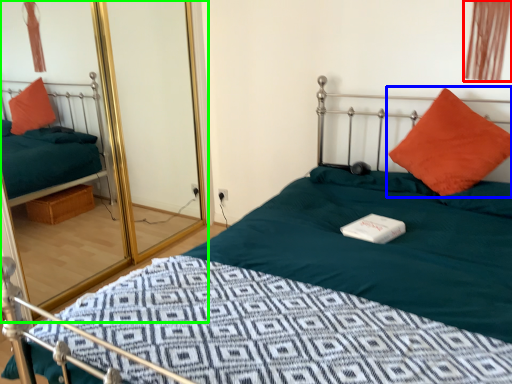
Question: Which object is positioned closest to curtain (highlighted by a red box)? Select from pillow (highlighted by a blue box) and glass door (highlighted by a green box).

Choices:
 (A) pillow
 (B) glass door

Answer: (A)